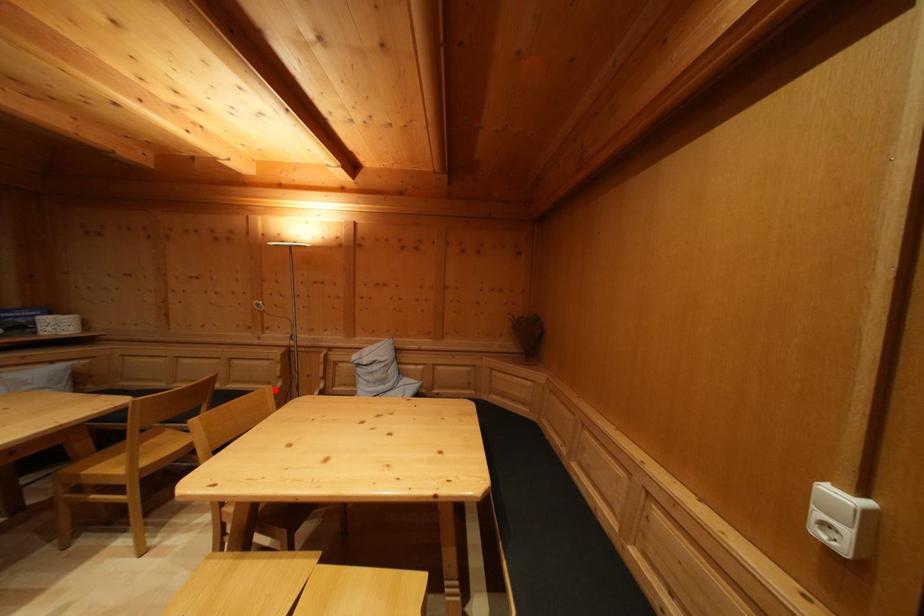
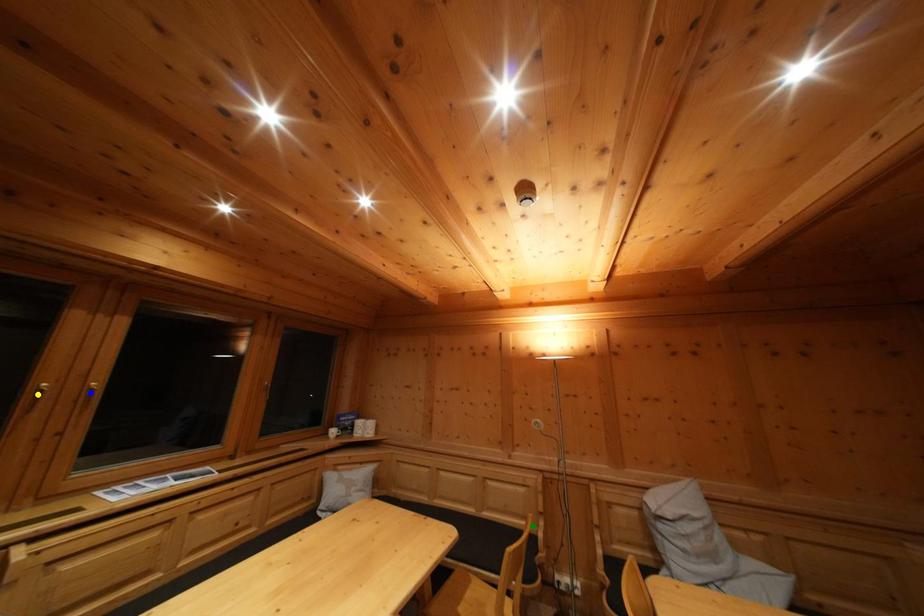
Question: I am providing you with two images of the same scene from different viewpoints. A red point is marked on the first image. You are given multiple points on the second image. Which point in image 2 is actually the same real-world point as the red point in image 1?

Choices:
 (A) blue point
 (B) yellow point
 (C) green point

Answer: (C)